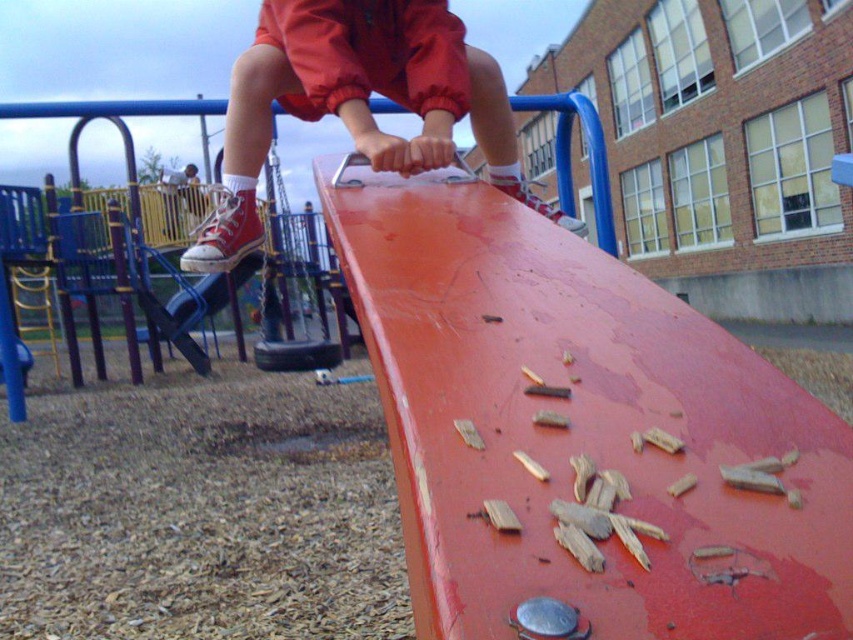
Is smooth red ramp at center to the right of rubberized black swing at center from the viewer's perspective?

Correct, you'll find smooth red ramp at center to the right of rubberized black swing at center.

Who is positioned more to the right, smooth red ramp at center or rubberized black swing at center?

Positioned to the right is smooth red ramp at center.

Identify the location of smooth red ramp at center. Image resolution: width=853 pixels, height=640 pixels. (579, 428).

Locate an element on the screen. smooth red ramp at center is located at coordinates (579, 428).

Measure the distance between smooth red ramp at center and camera.

15.08 inches

Is point (421, 214) farther from camera compared to point (183, 259)?

No.

At what (x,y) coordinates should I click in order to perform the action: click on smooth red ramp at center. Please return your answer as a coordinate pair (x, y). This screenshot has width=853, height=640. Looking at the image, I should click on (579, 428).

Is matte red sneakers at upper center shorter than rubberized black swing at center?

Indeed, matte red sneakers at upper center has a lesser height compared to rubberized black swing at center.

Between matte red sneakers at upper center and rubberized black swing at center, which one appears on the left side from the viewer's perspective?

rubberized black swing at center is more to the left.

The height and width of the screenshot is (640, 853). What do you see at coordinates (358, 102) in the screenshot?
I see `matte red sneakers at upper center` at bounding box center [358, 102].

This screenshot has height=640, width=853. I want to click on matte red sneakers at upper center, so click(x=358, y=102).